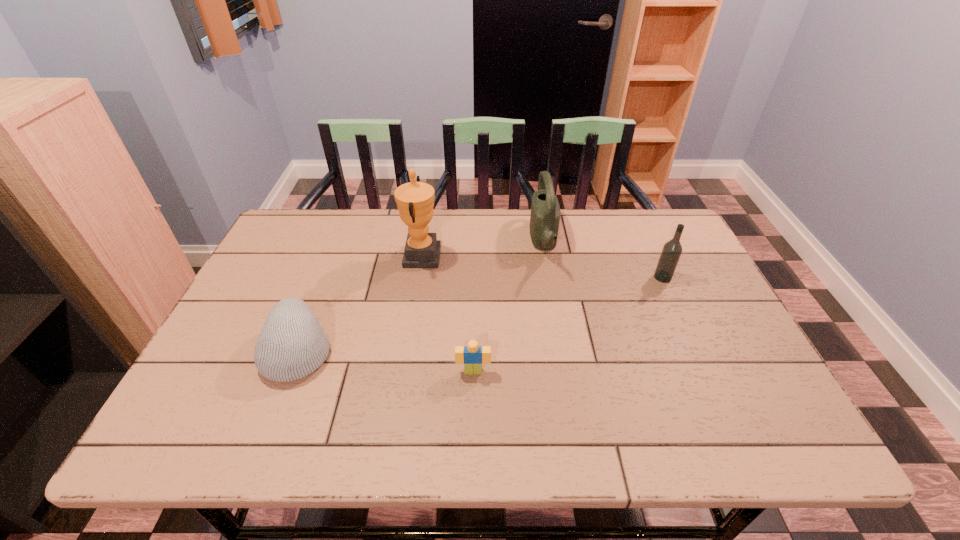
Where is `the fourth object from right to left`? the fourth object from right to left is located at coordinates (415, 200).

This screenshot has width=960, height=540. I want to click on award, so click(415, 200).

You are a GUI agent. You are given a task and a screenshot of the screen. Output one action in this format:
    pyautogui.click(x=<x>, y=<y>)
    Task: Click on the fourth object from left to right
    This screenshot has height=540, width=960.
    Given the screenshot: What is the action you would take?
    pyautogui.click(x=545, y=214)

You are a GUI agent. You are given a task and a screenshot of the screen. Output one action in this format:
    pyautogui.click(x=<x>, y=<y>)
    Task: Click on the vodka
    This screenshot has width=960, height=540.
    Given the screenshot: What is the action you would take?
    pyautogui.click(x=671, y=252)

Where is `the second shortest object`? This screenshot has height=540, width=960. the second shortest object is located at coordinates (292, 344).

Locate an element on the screen. Image resolution: width=960 pixels, height=540 pixels. beanie is located at coordinates [x=292, y=344].

The image size is (960, 540). Find the location of `the shortest object`. the shortest object is located at coordinates (472, 356).

Identify the location of the third object from left to right. The height and width of the screenshot is (540, 960). (472, 356).

This screenshot has height=540, width=960. I want to click on vacant region located at the front of the award with handles, so click(x=457, y=257).

This screenshot has height=540, width=960. In order to click on vacant space located on the spout of the watering can in this screenshot , I will do `click(439, 242)`.